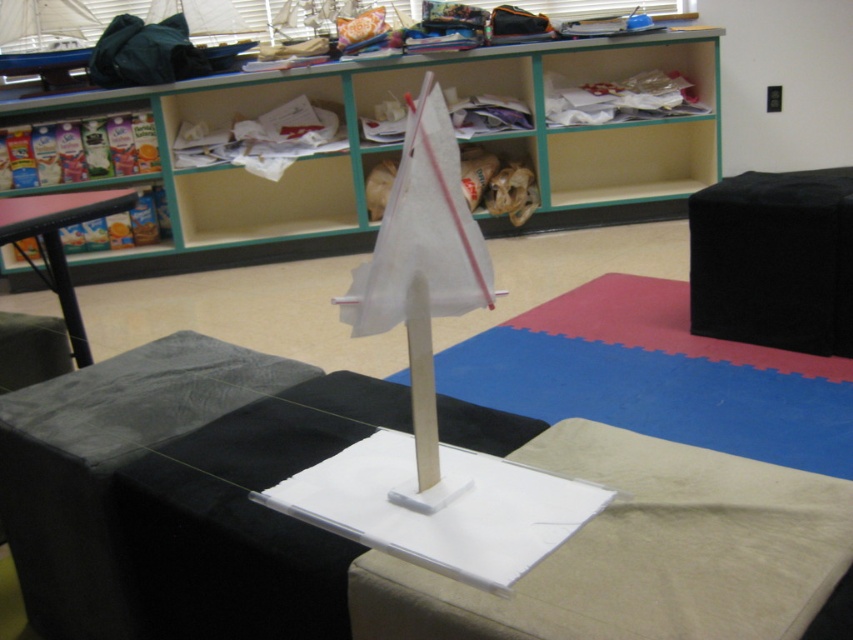
Between point (849, 228) and point (422, 156), which one is positioned in front?

Point (422, 156) is more forward.

This screenshot has width=853, height=640. Describe the element at coordinates (775, 260) in the screenshot. I see `black fabric stool at center` at that location.

Where is `black fabric stool at center`? black fabric stool at center is located at coordinates pos(775,260).

Does wooden bookshelf at upper center appear on the right side of blue rubber mat at center?

Incorrect, wooden bookshelf at upper center is not on the right side of blue rubber mat at center.

Is wooden bookshelf at upper center above blue rubber mat at center?

Yes, wooden bookshelf at upper center is above blue rubber mat at center.

Is point (531, 58) farther from viewer compared to point (514, 339)?

Yes.

In order to click on wooden bookshelf at upper center in this screenshot , I will do `click(399, 141)`.

Who is positioned more to the right, wooden bookshelf at upper center or black fabric stool at center?

black fabric stool at center

Is wooden bookshelf at upper center shorter than black fabric stool at center?

No.

Is point (206, 234) positioned after point (695, 253)?

Yes.

Identify the location of wooden bookshelf at upper center. (399, 141).